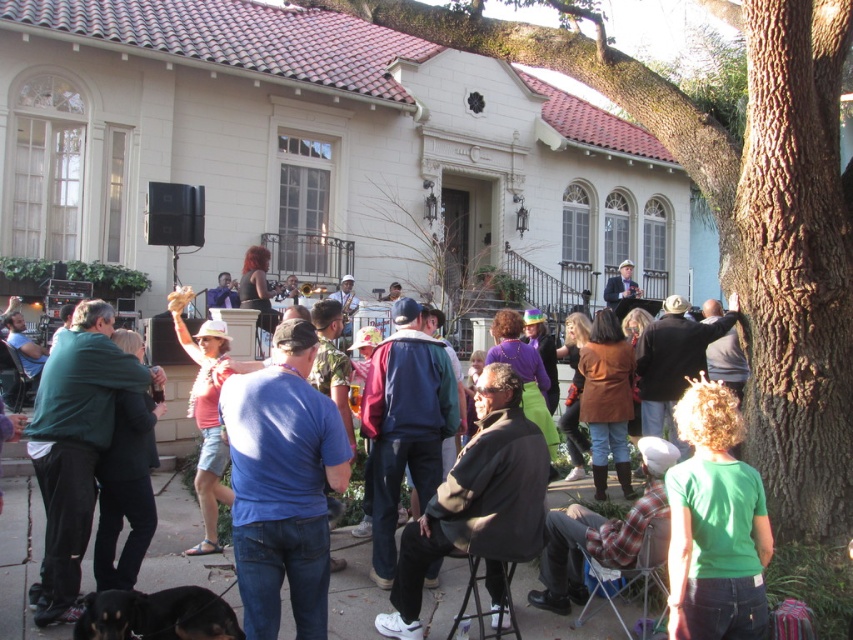
You are a photographer trying to capture a photo of the band performance. You notice the dark brown leather jacket at center and the flannel shirt at lower center are in your frame. Which clothing item is closer to the camera?

The dark brown leather jacket at center is closer to the camera because it is in front of the flannel shirt at lower center.

What are the coordinates of the blue denim jeans at center?

The coordinates of the blue denim jeans at center are at point (283,484).